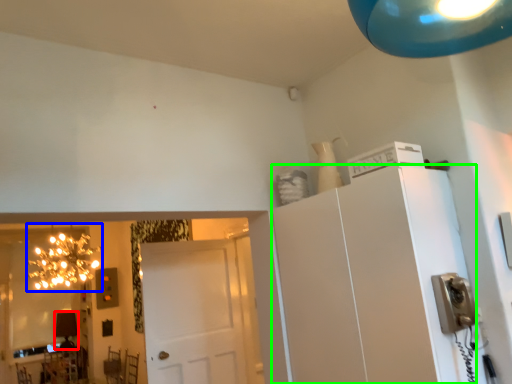
Question: Estimate the real-world distances between objects in this image. Which object is closer to lamp (highlighted by a red box), light fixture (highlighted by a blue box) or cabinetry (highlighted by a green box)?

Choices:
 (A) light fixture
 (B) cabinetry

Answer: (A)